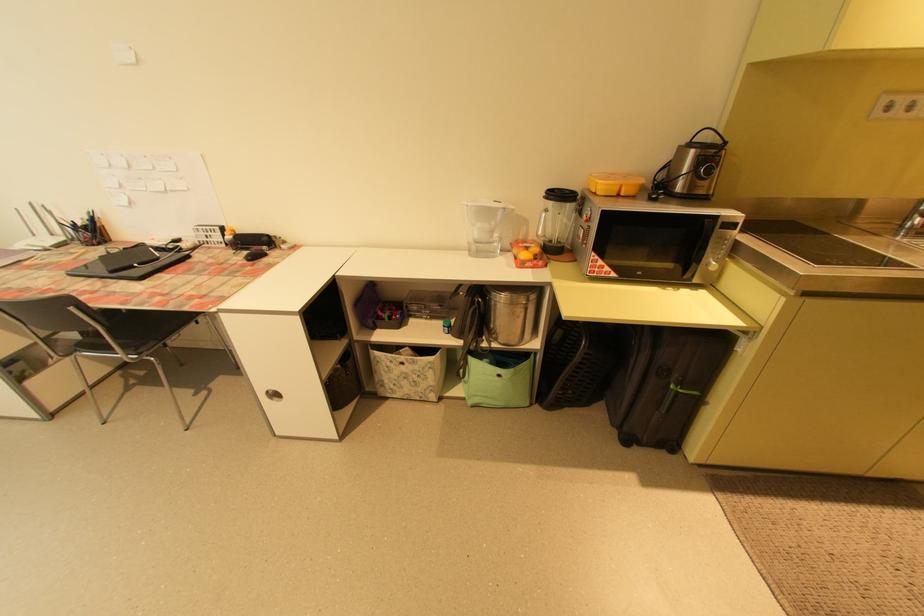
Where is `patterned storage basket`? This screenshot has width=924, height=616. patterned storage basket is located at coordinates (407, 371).